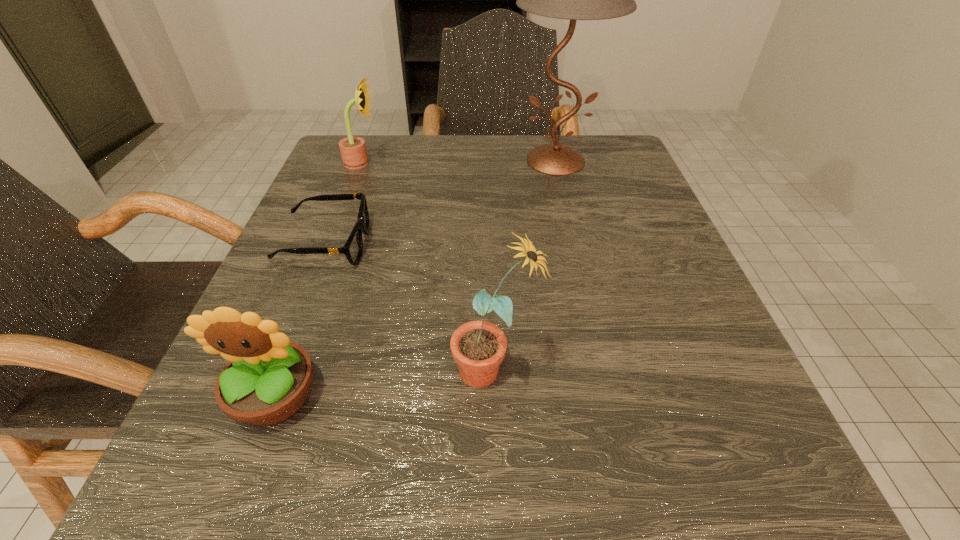
Locate an element on the screen. The height and width of the screenshot is (540, 960). free space at the far edge is located at coordinates (513, 148).

Find the location of a particular element. Image resolution: width=960 pixels, height=540 pixels. vacant position at the near edge of the desktop is located at coordinates (447, 511).

In the image, there is a desktop. Identify the location of blank space at the left edge. Image resolution: width=960 pixels, height=540 pixels. (313, 334).

Locate an element on the screen. blank area at the right edge is located at coordinates (672, 335).

You are a GUI agent. You are given a task and a screenshot of the screen. Output one action in this format:
    pyautogui.click(x=<x>, y=<y>)
    Task: Click on the blank space at the far left corner of the desktop
    Image resolution: width=960 pixels, height=540 pixels.
    Given the screenshot: What is the action you would take?
    pyautogui.click(x=397, y=146)

Where is `vacant space at the near left corner of the desktop`? This screenshot has width=960, height=540. vacant space at the near left corner of the desktop is located at coordinates (x=213, y=441).

This screenshot has height=540, width=960. I want to click on vacant region at the far right corner of the desktop, so click(581, 135).

Locate an element on the screen. The height and width of the screenshot is (540, 960). free area in between the table lamp and the farthest sunflower is located at coordinates (459, 162).

Find the location of a particular element. free space between the third nearest object and the farthest sunflower is located at coordinates (344, 204).

What are the coordinates of `vacant space in between the rightmost sunflower and the farthest sunflower` in the screenshot? It's located at (428, 266).